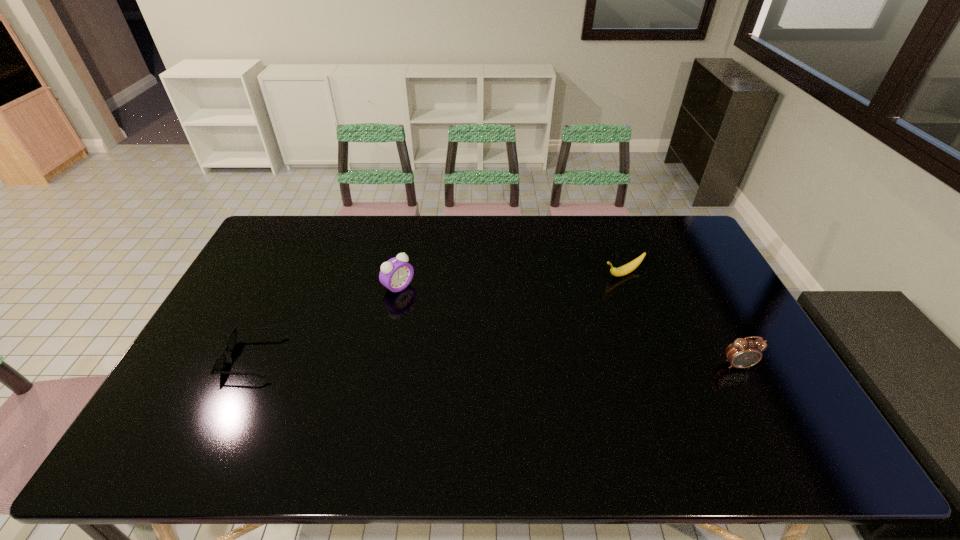
Where is `vacant area situated 0.370m at the stem of the banana`? This screenshot has width=960, height=540. vacant area situated 0.370m at the stem of the banana is located at coordinates (513, 321).

The width and height of the screenshot is (960, 540). In order to click on vacant space positioned at the stem of the banana in this screenshot , I will do `click(575, 293)`.

What are the coordinates of `vacant space located at the stem of the banana` in the screenshot? It's located at (516, 320).

Find the location of `free space located 0.090m on the face of the left alarm clock`. free space located 0.090m on the face of the left alarm clock is located at coordinates (428, 308).

Locate an element on the screen. Image resolution: width=960 pixels, height=540 pixels. vacant point located 0.280m on the face of the left alarm clock is located at coordinates (472, 341).

Image resolution: width=960 pixels, height=540 pixels. Identify the location of vacant space located 0.310m on the face of the left alarm clock. (480, 347).

I want to click on object that is at the left edge, so click(219, 364).

The height and width of the screenshot is (540, 960). What are the coordinates of `object positioned at the right edge` in the screenshot? It's located at (743, 353).

Locate an element on the screen. This screenshot has height=540, width=960. vacant space at the far edge of the desktop is located at coordinates (562, 226).

Locate an element on the screen. vacant area at the left edge is located at coordinates (194, 381).